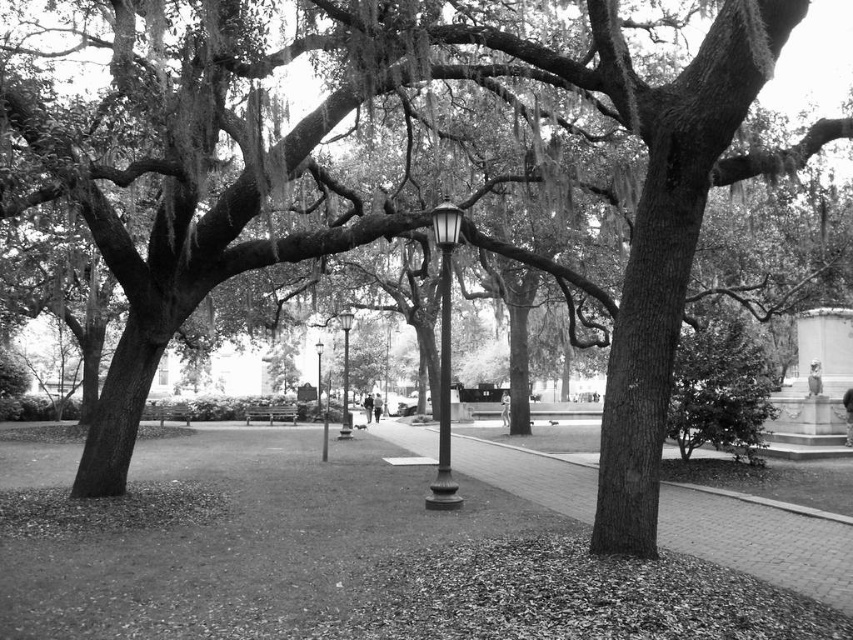
Is brick pavement at center bigger than metallic lamp post at center?

No, brick pavement at center is not bigger than metallic lamp post at center.

Which is above, brick pavement at center or metallic lamp post at center?

metallic lamp post at center is higher up.

You are a GUI agent. You are given a task and a screenshot of the screen. Output one action in this format:
    pyautogui.click(x=<x>, y=<y>)
    Task: Click on the brick pavement at center
    The height and width of the screenshot is (640, 853).
    Given the screenshot: What is the action you would take?
    pyautogui.click(x=761, y=540)

The width and height of the screenshot is (853, 640). What are the coordinates of `brick pavement at center` in the screenshot? It's located at (761, 540).

Is brick pavement at center further to the viewer compared to polished metal lamp post at center?

No, brick pavement at center is in front of polished metal lamp post at center.

Is brick pavement at center to the right of polished metal lamp post at center from the viewer's perspective?

Yes, brick pavement at center is to the right of polished metal lamp post at center.

Is point (584, 481) behind point (450, 346)?

Yes, it is behind point (450, 346).

Identify the location of brick pavement at center. (761, 540).

Does brick pavement at center appear under wooden bench at center?

No, brick pavement at center is not below wooden bench at center.

Is point (850, 596) positioned after point (259, 410)?

No, (850, 596) is closer to viewer.

What do you see at coordinates (761, 540) in the screenshot? I see `brick pavement at center` at bounding box center [761, 540].

Where is `brick pavement at center`? brick pavement at center is located at coordinates point(761,540).